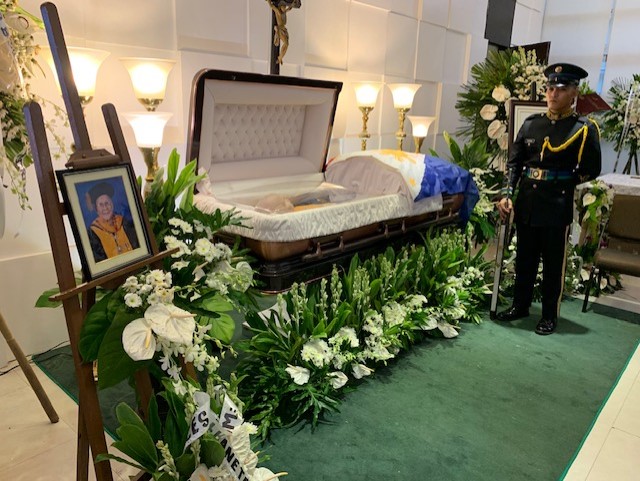
You are a GUI agent. You are given a task and a screenshot of the screen. Output one action in this format:
    pyautogui.click(x=<x>, y=<y>)
    Task: Click on the lights
    Image resolution: width=640 pixels, height=481 pixels.
    Given the screenshot: What is the action you would take?
    pyautogui.click(x=157, y=125), pyautogui.click(x=144, y=75), pyautogui.click(x=83, y=67), pyautogui.click(x=368, y=86), pyautogui.click(x=403, y=93), pyautogui.click(x=420, y=128)